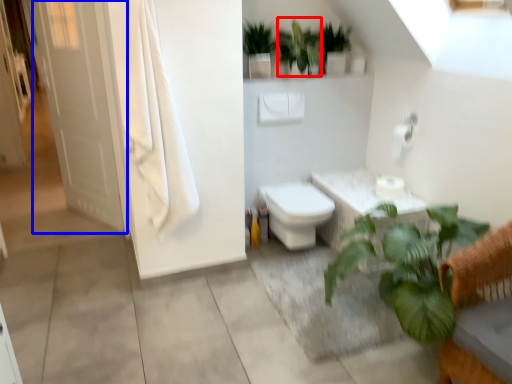
Question: Which object appears closest to the camera in this image, vegetation (highlighted by a red box) or screen door (highlighted by a blue box)?

Choices:
 (A) vegetation
 (B) screen door

Answer: (A)